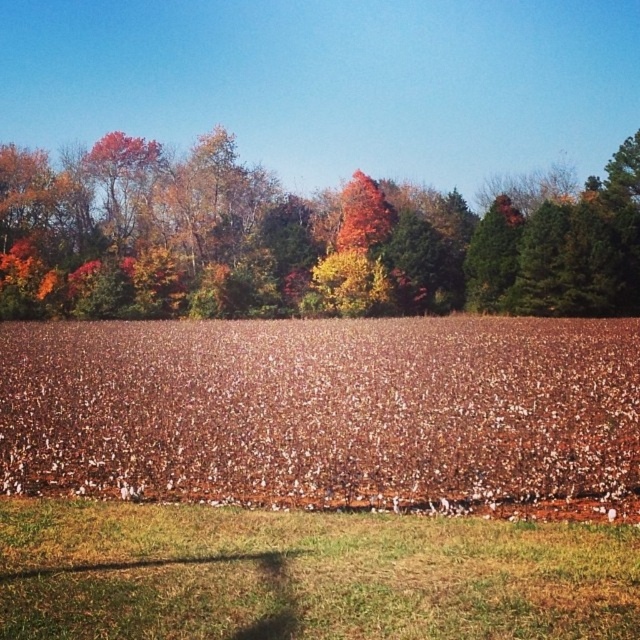
You are standing in the middle of the cotton field and see the autumn leaves at upper center and the brown grass at lower center. Which object is located to the right of the other?

The autumn leaves at upper center is positioned on the right side of brown grass at lower center.

You are a landscape photographer planning to capture the autumn leaves at upper center and brown grass at lower center in your shot. Which of these two elements will appear bigger in your photograph?

The autumn leaves at upper center will appear bigger in the photograph because they are larger in size than the brown grass at lower center.

You are a farmer standing in the middle of the cotton field. You notice autumn leaves at upper center and brown grass at lower center. Which one is taller?

The autumn leaves at upper center is much taller as brown grass at lower center.